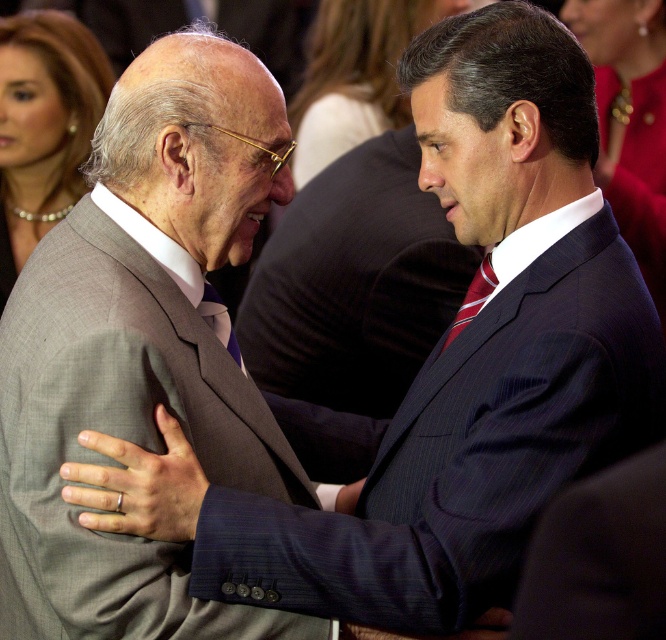
Who is more distant from viewer, (450, 336) or (208, 296)?

Point (450, 336)

Is point (490, 272) positioned before point (226, 346)?

Yes, it is.

Measure the distance between point (486, 269) and camera.

They are 5.96 feet apart.

Find the location of `striped silk tie at center`. striped silk tie at center is located at coordinates (474, 298).

Is dark blue pinstripe suit at center above blue striped tie at center?

Yes.

Is point (352, 272) positioned before point (204, 305)?

That is False.

At what (x,y) coordinates should I click in order to perform the action: click on dark blue pinstripe suit at center. Please return your answer as a coordinate pair (x, y). The width and height of the screenshot is (666, 640). Looking at the image, I should click on (352, 301).

Where is `gray suit at left`? The image size is (666, 640). gray suit at left is located at coordinates (143, 348).

Can you confirm if gray suit at left is smaller than dark blue pinstripe suit at center?

Answer: No.

Find the location of a particular element. This screenshot has width=666, height=640. gray suit at left is located at coordinates (143, 348).